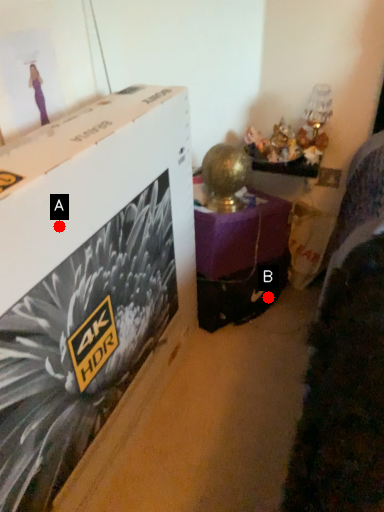
Question: Two points are circled on the image, labeled by A and B beside each circle. Which of the following is the farthest from the observer?

Choices:
 (A) A is further
 (B) B is further

Answer: (B)